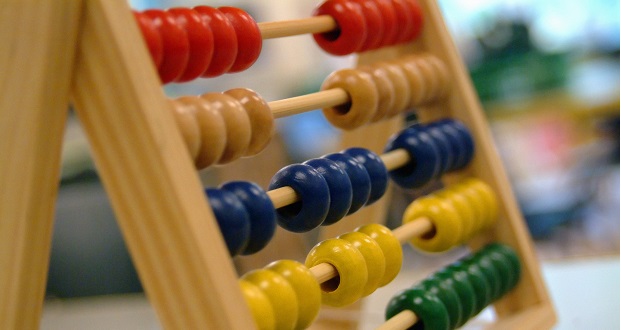
The height and width of the screenshot is (330, 621). In order to click on woden frame of abacus in this screenshot , I will do `click(522, 324)`, `click(487, 153)`, `click(376, 133)`, `click(153, 183)`, `click(42, 147)`.